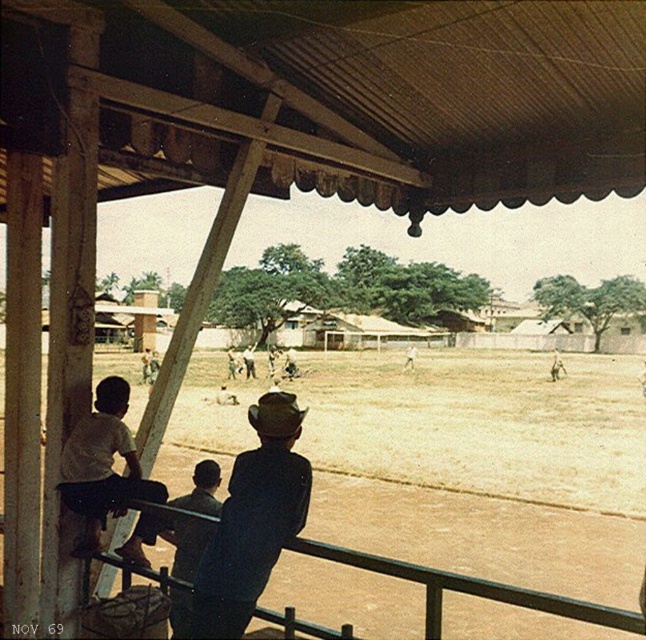
You are standing at the point closer to the camera between point (5,68) and point (286,497). Which point are you at?

You are at point (5,68) because it is further to the camera than point (286,497), so it is the closer point to you.

You are a photographer trying to capture a clear shot of the dark blue shirt at center without the dark blue denim jacket at center blocking it. Is the jacket currently covering the shirt?

The dark blue denim jacket at center is positioned over dark blue shirt at center, so yes, the jacket is currently covering the shirt.

You are standing at the point marked by the coordinates point (348,96). What object is exactly at that location?

The brown corrugated metal at upper center is exactly at point (348,96).